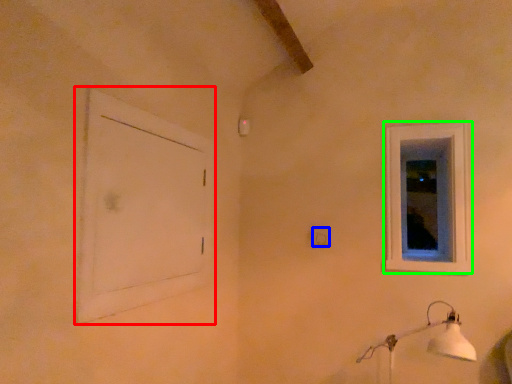
Question: Considering the real-world distances, which object is farthest from window frame (highlighted by a red box)? electric outlet (highlighted by a blue box) or window (highlighted by a green box)?

Choices:
 (A) electric outlet
 (B) window

Answer: (B)